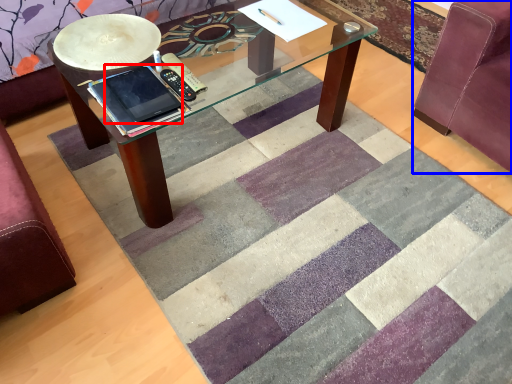
Question: Which object appears closest to the camera in this image, ipad (highlighted by a red box) or swivel chair (highlighted by a blue box)?

Choices:
 (A) ipad
 (B) swivel chair

Answer: (A)